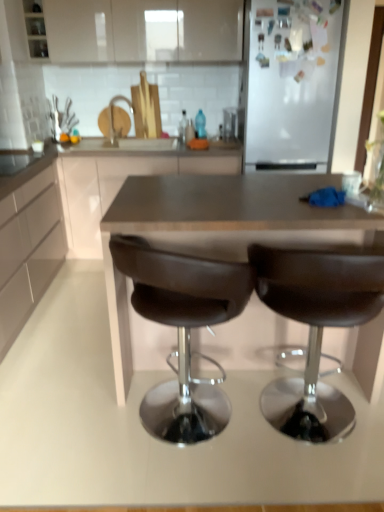
Locate an element on the screen. free point to the left of brown leather chair at center, which is the second chair in right-to-left order is located at coordinates (71, 423).